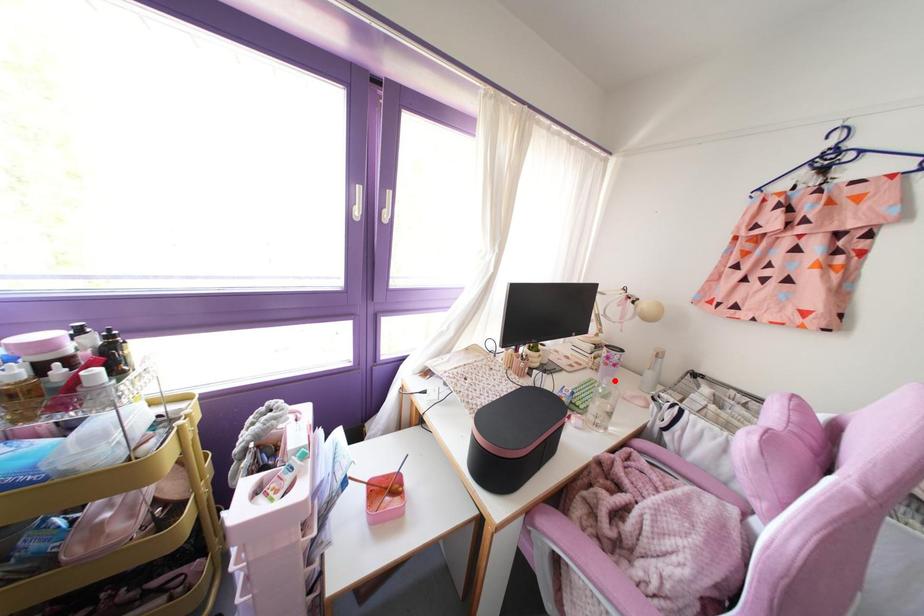
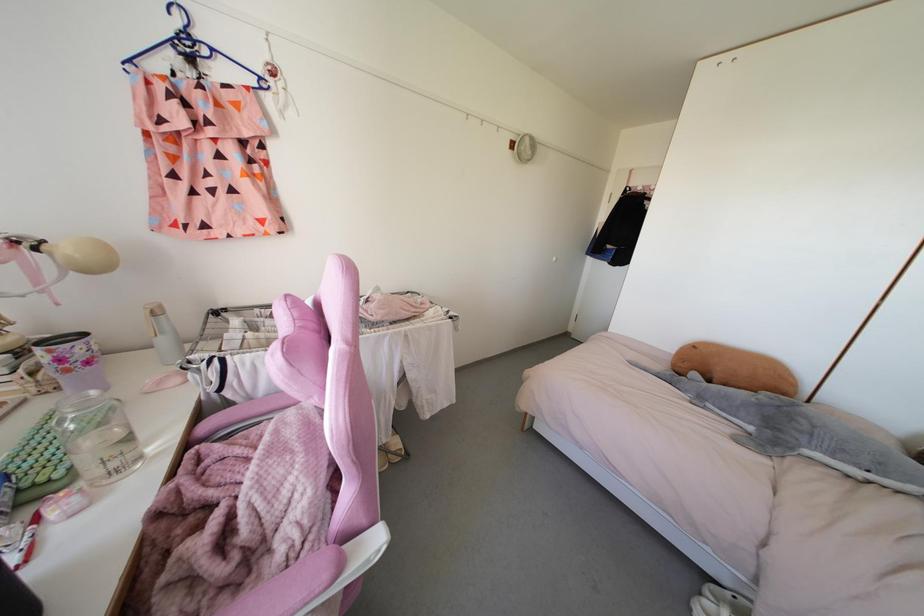
Locate, in the second image, the point that corresponds to the highlighted location in the first image.

(92, 392)